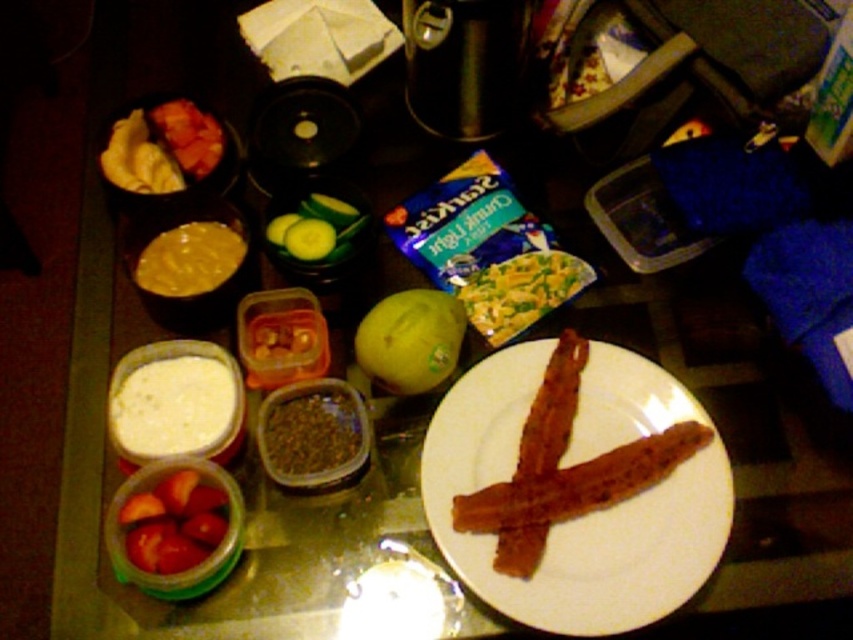
Question: Which point appears closest to the camera in this image?

Choices:
 (A) (494, 320)
 (B) (445, 301)
 (C) (566, 420)

Answer: (C)

Question: Can you confirm if green matte apple at center is positioned to the left of yellow-green creamy pasta at center?

Choices:
 (A) yes
 (B) no

Answer: (A)

Question: Is yellow creamy sauce at center above tomato slices at center?

Choices:
 (A) no
 (B) yes

Answer: (A)

Question: Which object appears closest to the camera in this image?

Choices:
 (A) shiny red tomatoes at lower left
 (B) green matte apple at center

Answer: (A)

Question: Does white matte plate at center appear over green matte apple at center?

Choices:
 (A) no
 (B) yes

Answer: (A)

Question: Which point is closer to the camera?

Choices:
 (A) (526, 541)
 (B) (198, 285)
 (C) (172, 524)

Answer: (A)